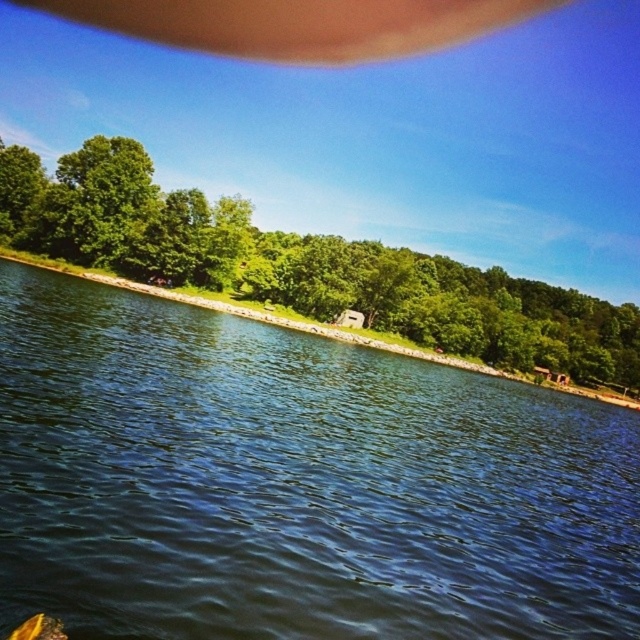
Who is higher up, blue water at center or green leafy tree at center?

green leafy tree at center is higher up.

Does blue water at center have a lesser width compared to green leafy tree at center?

Correct, blue water at center's width is less than green leafy tree at center's.

Who is more distant from viewer, [308,554] or [204,196]?

Point [204,196]

The height and width of the screenshot is (640, 640). I want to click on blue water at center, so click(292, 483).